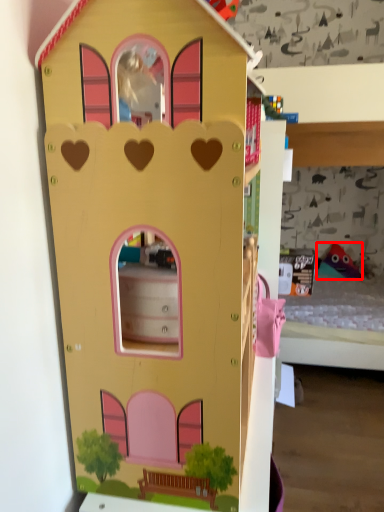
Question: In this image, where is toy (annotated by the red box) located relative to toy?

Choices:
 (A) left
 (B) right

Answer: (B)